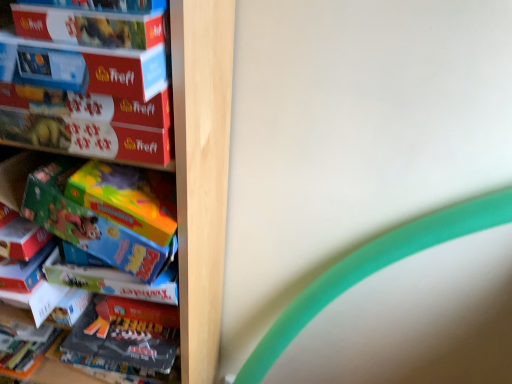
Question: Does matte cardboard box at upper left, acting as the second paperback book starting from the bottom, have a lesser height compared to green matte toy at left?

Choices:
 (A) yes
 (B) no

Answer: (A)

Question: From a real-world perspective, is matte cardboard box at upper left, acting as the second paperback book starting from the bottom, positioned over green matte toy at left based on gravity?

Choices:
 (A) yes
 (B) no

Answer: (A)

Question: Can you confirm if matte cardboard box at upper left, the first paperback book when ordered from top to bottom, is thinner than green matte toy at left?

Choices:
 (A) yes
 (B) no

Answer: (B)

Question: Considering the relative positions of matte cardboard box at upper left, the first paperback book when ordered from top to bottom, and green matte toy at left in the image provided, is matte cardboard box at upper left, the first paperback book when ordered from top to bottom, to the left of green matte toy at left from the viewer's perspective?

Choices:
 (A) no
 (B) yes

Answer: (A)

Question: From a real-world perspective, is matte cardboard box at upper left, acting as the second paperback book starting from the bottom, below green matte toy at left?

Choices:
 (A) no
 (B) yes

Answer: (A)

Question: From the image's perspective, relative to matte red puzzle box at upper left, which is the second paperback book from top to bottom, is green matte toy at left above or below?

Choices:
 (A) below
 (B) above

Answer: (A)

Question: Is green matte toy at left taller or shorter than matte red puzzle box at upper left, which is the second paperback book from top to bottom?

Choices:
 (A) tall
 (B) short

Answer: (A)

Question: Considering the positions of green matte toy at left and matte red puzzle box at upper left, which is the second paperback book from top to bottom, in the image, is green matte toy at left wider or thinner than matte red puzzle box at upper left, which is the second paperback book from top to bottom,?

Choices:
 (A) wide
 (B) thin

Answer: (B)

Question: Based on their sizes in the image, would you say green matte toy at left is bigger or smaller than matte red puzzle box at upper left, which is the second paperback book from top to bottom?

Choices:
 (A) big
 (B) small

Answer: (A)

Question: Would you say matte cardboard box at upper left, the first paperback book when ordered from top to bottom, is to the left or to the right of wooden puzzle boxes at left in the picture?

Choices:
 (A) left
 (B) right

Answer: (B)

Question: Looking at the image, does matte cardboard box at upper left, the first paperback book when ordered from top to bottom, seem bigger or smaller compared to wooden puzzle boxes at left?

Choices:
 (A) big
 (B) small

Answer: (B)

Question: From a real-world perspective, is matte cardboard box at upper left, the first paperback book when ordered from top to bottom, physically located above or below wooden puzzle boxes at left?

Choices:
 (A) above
 (B) below

Answer: (A)

Question: Considering their positions, is matte cardboard box at upper left, the first paperback book when ordered from top to bottom, located in front of or behind wooden puzzle boxes at left?

Choices:
 (A) front
 (B) behind

Answer: (A)

Question: Is wooden puzzle boxes at left inside the boundaries of green matte toy at left, or outside?

Choices:
 (A) inside
 (B) outside

Answer: (B)

Question: Is wooden puzzle boxes at left in front of or behind green matte toy at left in the image?

Choices:
 (A) front
 (B) behind

Answer: (A)